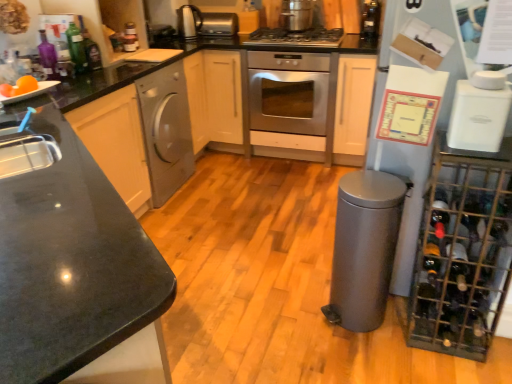
At what (x,y) coordinates should I click in order to perform the action: click on free space above white plastic appliance at upper right, acting as the second kitchen appliance starting from the left (from a real-world perspective). Please return your answer as a coordinate pair (x, y). The width and height of the screenshot is (512, 384). Looking at the image, I should click on (484, 91).